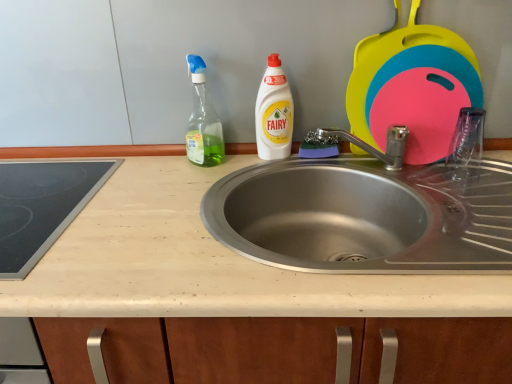
Locate an element on the screen. The image size is (512, 384). free location in front of white plastic bottle at center, placed as the second cleaning product when sorted from left to right is located at coordinates (248, 177).